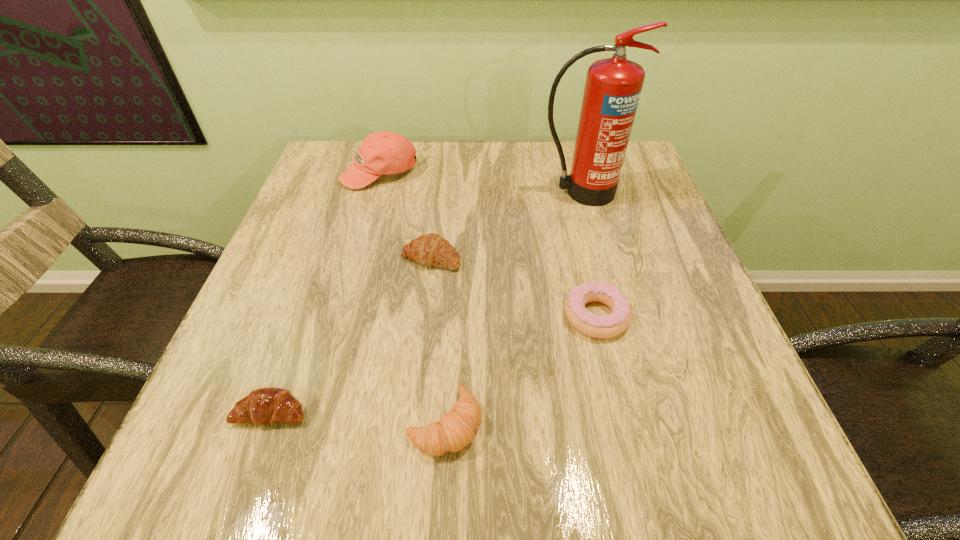
Where is `free spot between the fifth shortest object and the shortest crescent roll`? free spot between the fifth shortest object and the shortest crescent roll is located at coordinates (325, 292).

Image resolution: width=960 pixels, height=540 pixels. What are the coordinates of `vacant space that's between the leftmost crescent roll and the farthest crescent roll` in the screenshot? It's located at (351, 334).

The image size is (960, 540). In order to click on free space between the fourth farthest object and the fire extinguisher in this screenshot , I will do `click(588, 254)`.

You are a GUI agent. You are given a task and a screenshot of the screen. Output one action in this format:
    pyautogui.click(x=<x>, y=<y>)
    Task: Click on the unoccupied area between the fourth nearest object and the fourth farthest object
    
    Given the screenshot: What is the action you would take?
    pyautogui.click(x=514, y=287)

Locate an element on the screen. This screenshot has height=540, width=960. object that is the closest to the baseball cap is located at coordinates (430, 250).

The height and width of the screenshot is (540, 960). In order to click on object that can be found as the fourth closest to the fourth farthest object in this screenshot , I will do `click(265, 406)`.

Locate an element on the screen. The width and height of the screenshot is (960, 540). crescent roll that can be found as the second closest to the fourth farthest object is located at coordinates (430, 250).

Identify the location of crescent roll that is the third nearest to the fifth shortest object. (265, 406).